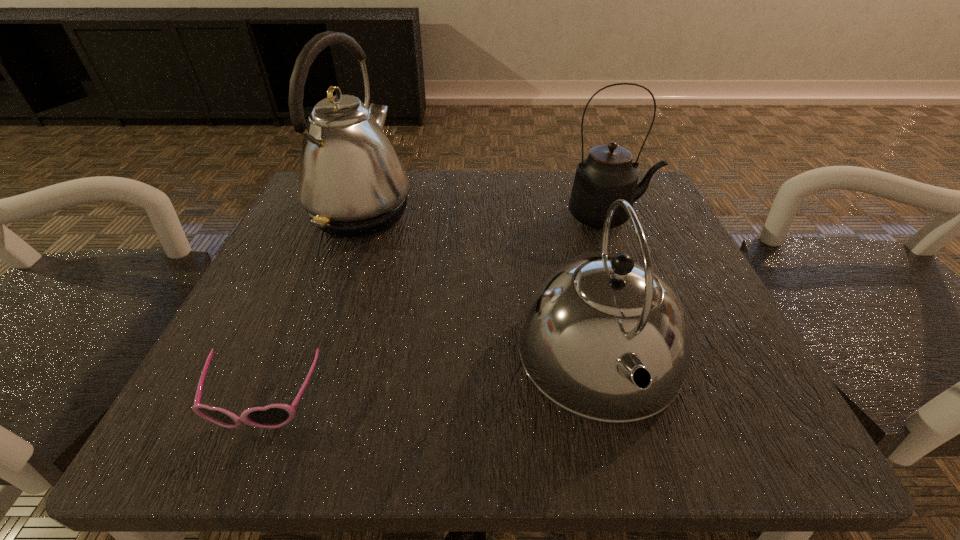
I want to click on object that is at the near left corner, so click(272, 416).

Locate an element on the screen. The height and width of the screenshot is (540, 960). object that is at the far right corner is located at coordinates (608, 174).

Find the location of a particular element. This screenshot has width=960, height=540. object located in the near right corner section of the desktop is located at coordinates (605, 338).

The height and width of the screenshot is (540, 960). Find the location of `vacant point at the far edge`. vacant point at the far edge is located at coordinates (450, 213).

This screenshot has width=960, height=540. Find the location of `blank space at the near edge`. blank space at the near edge is located at coordinates (419, 438).

Where is `vacant space at the left edge of the desktop`? The height and width of the screenshot is (540, 960). vacant space at the left edge of the desktop is located at coordinates (256, 276).

What are the coordinates of `free space at the right edge of the desktop` in the screenshot? It's located at (734, 331).

The width and height of the screenshot is (960, 540). What are the coordinates of `free space at the far right corner of the desktop` in the screenshot? It's located at (641, 216).

The width and height of the screenshot is (960, 540). I want to click on vacant area that lies between the tallest object and the sunglasses, so click(x=312, y=307).

The width and height of the screenshot is (960, 540). I want to click on free space between the nearest kettle and the sunglasses, so click(432, 379).